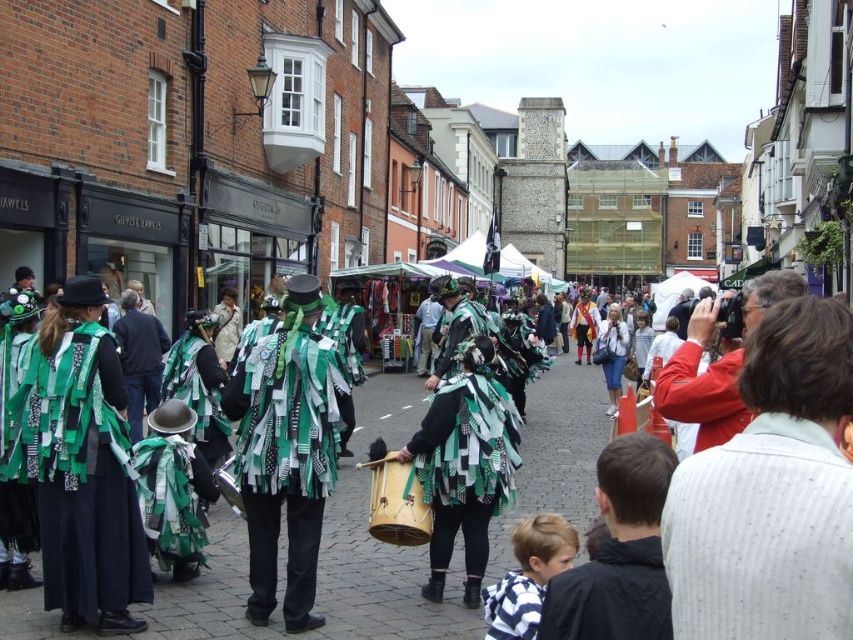
You are standing on the cobblestone street in the historic town and see two points marked in the scene. The first point is at coordinates point [399,550] and the second point is at point [405,524]. Which point is farther away from you?

Point [399,550] is behind point [405,524], so it is farther away from you.

You are a photographer standing on the cobblestone street and want to take a photo that includes both the point at coordinates point (531, 504) and point (738, 364). Which point should you focus on first to ensure both are in focus?

You should focus on point (531, 504) first because it is closer to the camera than point (738, 364). This ensures that both points will be in focus as the closer point determines the focal plane.

Consider the image. You are a photographer standing on the cobblestone street in the historic town. You want to capture a photo that includes both the red jacket at right and the wooden drum at center. Which object should you focus on first to ensure both are in the frame?

The red jacket at right is located above the wooden drum at center, so you should focus on the wooden drum at center first to ensure both are in the frame.